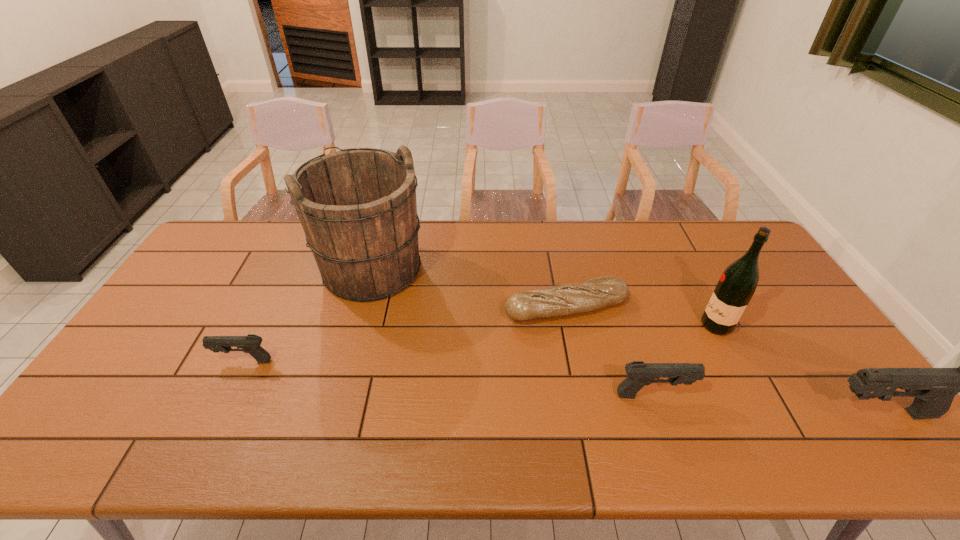
Locate an element on the screen. The width and height of the screenshot is (960, 540). the leftmost pistol is located at coordinates (251, 343).

I want to click on the farthest pistol, so click(x=251, y=343).

Locate an element on the screen. the third shortest object is located at coordinates (639, 374).

The height and width of the screenshot is (540, 960). What are the coordinates of `the second nearest object` in the screenshot? It's located at (639, 374).

What are the coordinates of `the rightmost object` in the screenshot? It's located at (934, 389).

Identify the location of the nearest object. (934, 389).

Identify the location of baguet. pos(562,300).

In order to click on the second object from left to right in this screenshot , I will do `click(357, 206)`.

At what (x,y) coordinates should I click in order to perform the action: click on the second object from right to left. Please return your answer as a coordinate pair (x, y). The width and height of the screenshot is (960, 540). Looking at the image, I should click on (737, 284).

Image resolution: width=960 pixels, height=540 pixels. Identify the location of vacant space located at the barrel of the leftmost pistol. (168, 361).